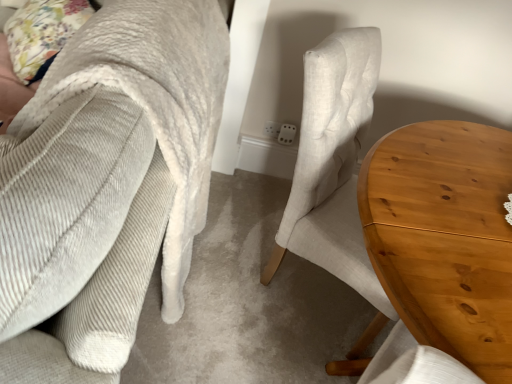
Question: From a real-world perspective, is floral fabric pillow at upper left located beneath light brown wood table at center right?

Choices:
 (A) no
 (B) yes

Answer: (A)

Question: Is floral fabric pillow at upper left touching light brown wood table at center right?

Choices:
 (A) yes
 (B) no

Answer: (B)

Question: Is floral fabric pillow at upper left closer to camera compared to light brown wood table at center right?

Choices:
 (A) yes
 (B) no

Answer: (B)

Question: Can you confirm if floral fabric pillow at upper left is bigger than light brown wood table at center right?

Choices:
 (A) no
 (B) yes

Answer: (A)

Question: Can you confirm if floral fabric pillow at upper left is shorter than light brown wood table at center right?

Choices:
 (A) no
 (B) yes

Answer: (B)

Question: Is corduroy fabric chair at center taller or shorter than floral fabric pillow at upper left?

Choices:
 (A) short
 (B) tall

Answer: (B)

Question: Considering the relative positions of corduroy fabric chair at center and floral fabric pillow at upper left in the image provided, is corduroy fabric chair at center to the left or to the right of floral fabric pillow at upper left?

Choices:
 (A) left
 (B) right

Answer: (A)

Question: Considering the positions of point (160, 226) and point (55, 44), is point (160, 226) closer or farther from the camera than point (55, 44)?

Choices:
 (A) closer
 (B) farther

Answer: (A)

Question: From the image's perspective, is corduroy fabric chair at center located above or below floral fabric pillow at upper left?

Choices:
 (A) below
 (B) above

Answer: (A)

Question: Relative to floral fabric pillow at upper left, is light brown wood table at center right in front or behind?

Choices:
 (A) behind
 (B) front

Answer: (B)

Question: Is light brown wood table at center right to the left or to the right of floral fabric pillow at upper left in the image?

Choices:
 (A) right
 (B) left

Answer: (A)

Question: From a real-world perspective, is light brown wood table at center right above or below floral fabric pillow at upper left?

Choices:
 (A) below
 (B) above

Answer: (A)

Question: Is light brown wood table at center right inside or outside of floral fabric pillow at upper left?

Choices:
 (A) inside
 (B) outside

Answer: (B)

Question: From a real-world perspective, is floral fabric pillow at upper left above or below light brown wood table at center right?

Choices:
 (A) above
 (B) below

Answer: (A)

Question: Looking at their shapes, would you say floral fabric pillow at upper left is wider or thinner than light brown wood table at center right?

Choices:
 (A) wide
 (B) thin

Answer: (B)